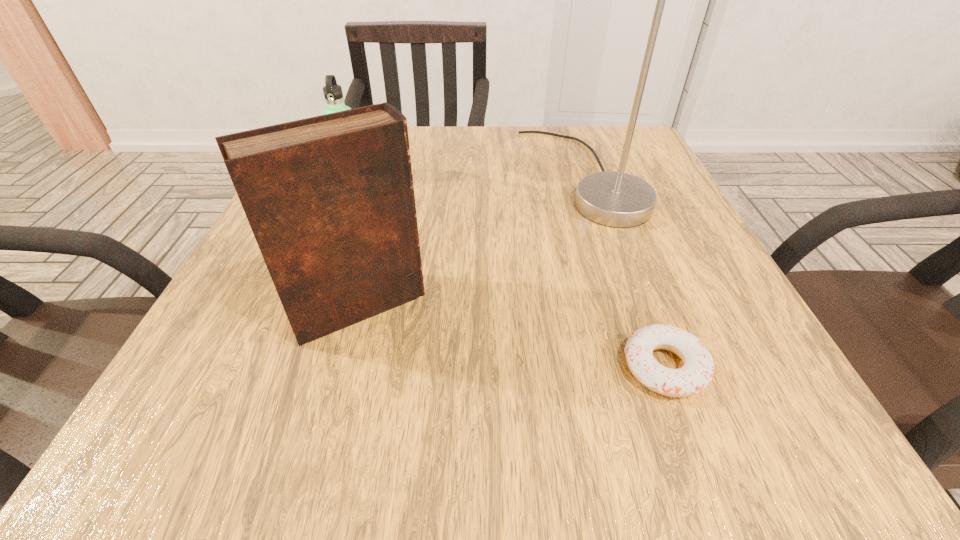
Find the location of a particular element. The image size is (960, 540). vacant region at the right edge of the desktop is located at coordinates (721, 317).

The width and height of the screenshot is (960, 540). In order to click on free region at the near left corner of the desktop in this screenshot , I will do `click(275, 418)`.

Image resolution: width=960 pixels, height=540 pixels. What are the coordinates of `vacant space at the far right corner` in the screenshot? It's located at (605, 170).

The image size is (960, 540). In the image, there is a desktop. Identify the location of vacant space at the near right corner. (719, 428).

You are a GUI agent. You are given a task and a screenshot of the screen. Output one action in this format:
    pyautogui.click(x=<x>, y=<y>)
    Task: Click on the vacant space in between the table lamp and the shortest object
    
    Given the screenshot: What is the action you would take?
    [625, 272]

What are the coordinates of `free spot between the third shortest object and the table lamp` in the screenshot? It's located at (472, 241).

Locate an element on the screen. free area in between the shortest object and the third shortest object is located at coordinates (512, 336).

Where is `free spot between the third shortest object and the shortest object`? The image size is (960, 540). free spot between the third shortest object and the shortest object is located at coordinates (512, 336).

The width and height of the screenshot is (960, 540). Identify the location of vacant point located between the second tallest object and the doughnut. (512, 336).

Where is `empty space between the third shortest object and the tallest object`? empty space between the third shortest object and the tallest object is located at coordinates (472, 241).